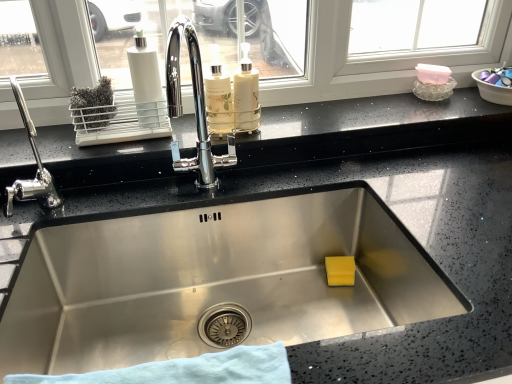
Question: Considering the positions of point (12, 81) and point (207, 125), is point (12, 81) closer or farther from the camera than point (207, 125)?

Choices:
 (A) farther
 (B) closer

Answer: (A)

Question: Considering their positions, is chrome metallic faucet at left located in front of or behind translucent glass bottle at center, arranged as the 1th bottle when viewed from the left?

Choices:
 (A) behind
 (B) front

Answer: (B)

Question: Considering the real-world distances, which object is closest to the blue cloth at bottom?

Choices:
 (A) chrome metallic faucet at left
 (B) white matte bottle at center, positioned as the second bottle in left-to-right order
 (C) translucent glass bottle at center, positioned as the second bottle in right-to-left order

Answer: (A)

Question: Estimate the real-world distances between objects in this image. Which object is farther from the white matte bottle at center, positioned as the second bottle in left-to-right order?

Choices:
 (A) blue cloth at bottom
 (B) translucent glass bottle at center, arranged as the 1th bottle when viewed from the left
 (C) chrome metallic faucet at left

Answer: (A)